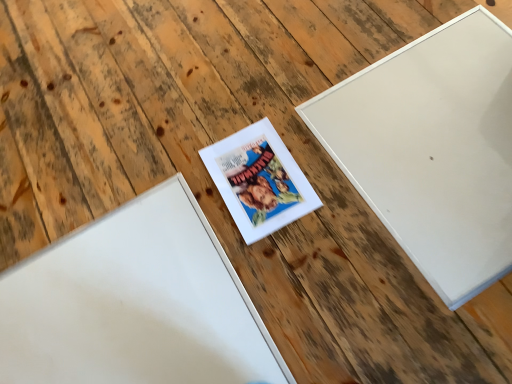
You are a GUI agent. You are given a task and a screenshot of the screen. Output one action in this format:
    pyautogui.click(x=<x>, y=<y>)
    Task: Click on the vacant space that is in between white matte picture frame at center, which is the second picture frame from left to right, and white matte picture frame at upper right, arranged as the first picture frame when viewed from the right
    This screenshot has height=384, width=512.
    Given the screenshot: What is the action you would take?
    pyautogui.click(x=328, y=210)